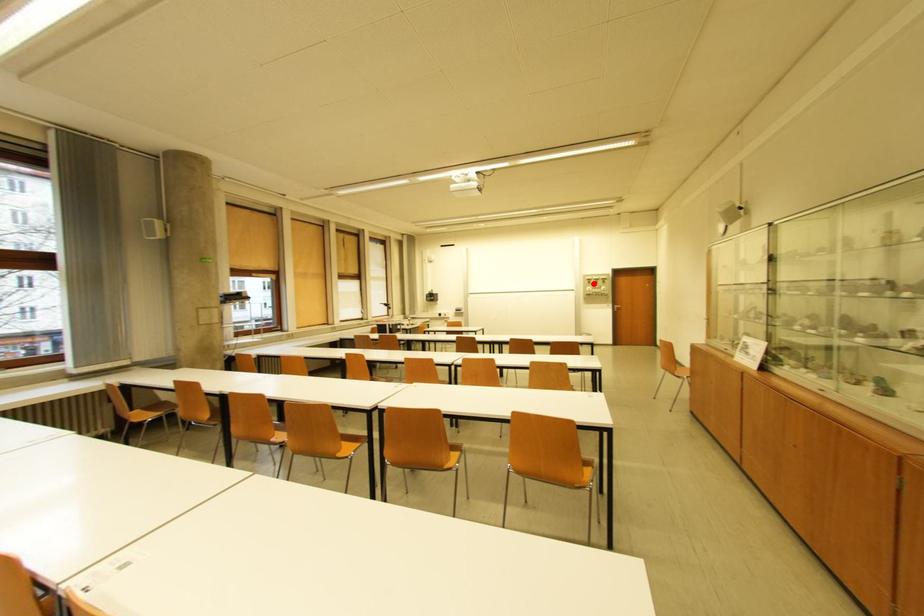
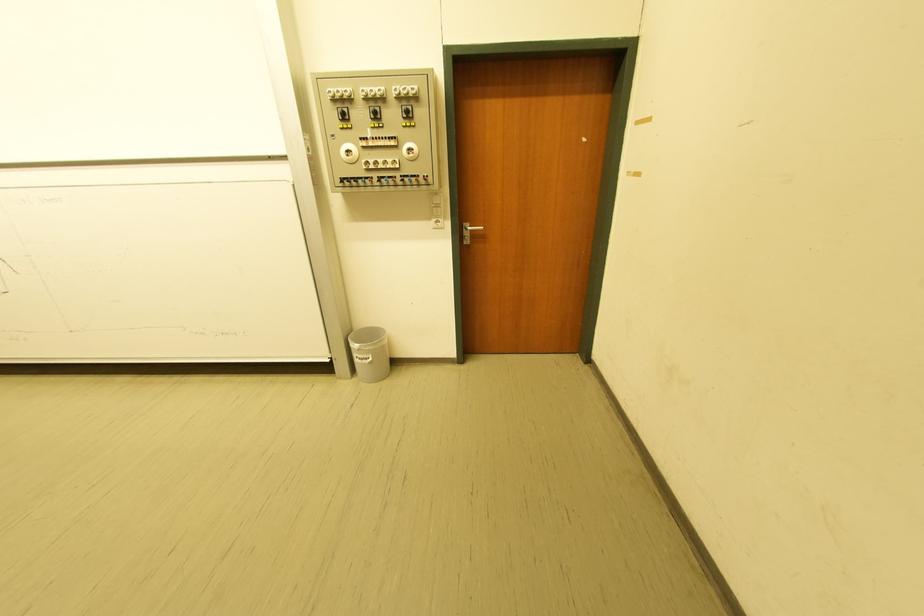
Question: A red point is marked in image1. In image2, is the corresponding 3D point closer to the camera or farther? Reply with the corresponding letter.

Choices:
 (A) The corresponding 3D point is closer.
 (B) The corresponding 3D point is farther.

Answer: (B)